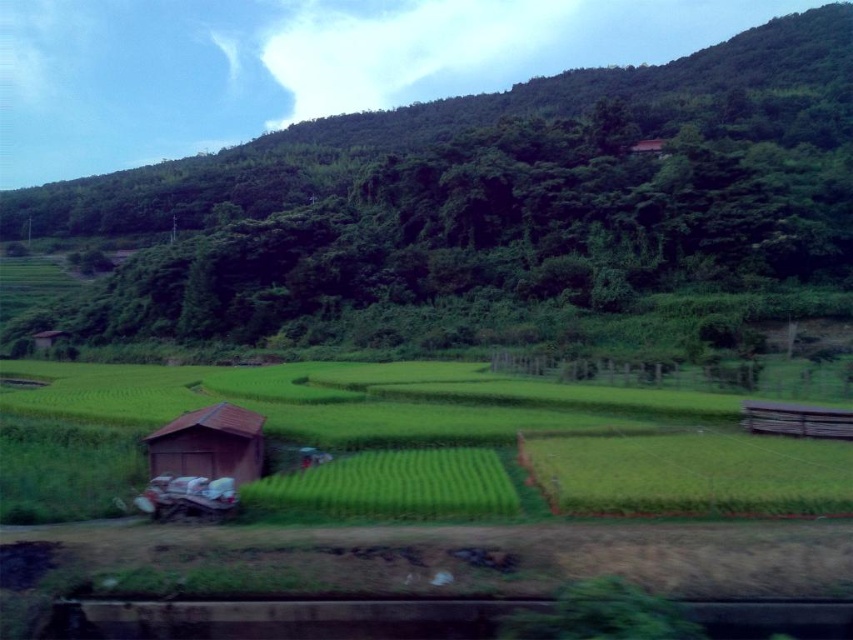
Question: Which is farther from the brown wooden hut at lower left?

Choices:
 (A) green grassy field at center
 (B) green leafy forest at upper center

Answer: (B)

Question: Is green leafy forest at upper center wider than brown wooden hut at lower left?

Choices:
 (A) yes
 (B) no

Answer: (A)

Question: Can you confirm if green grassy field at center is wider than brown wooden hut at lower left?

Choices:
 (A) no
 (B) yes

Answer: (B)

Question: Does green leafy forest at upper center have a smaller size compared to green grassy field at center?

Choices:
 (A) no
 (B) yes

Answer: (A)

Question: Which object appears closest to the camera in this image?

Choices:
 (A) green grassy field at center
 (B) green leafy forest at upper center

Answer: (A)

Question: Which object appears closest to the camera in this image?

Choices:
 (A) green leafy forest at upper center
 (B) brown wooden hut at lower left

Answer: (B)